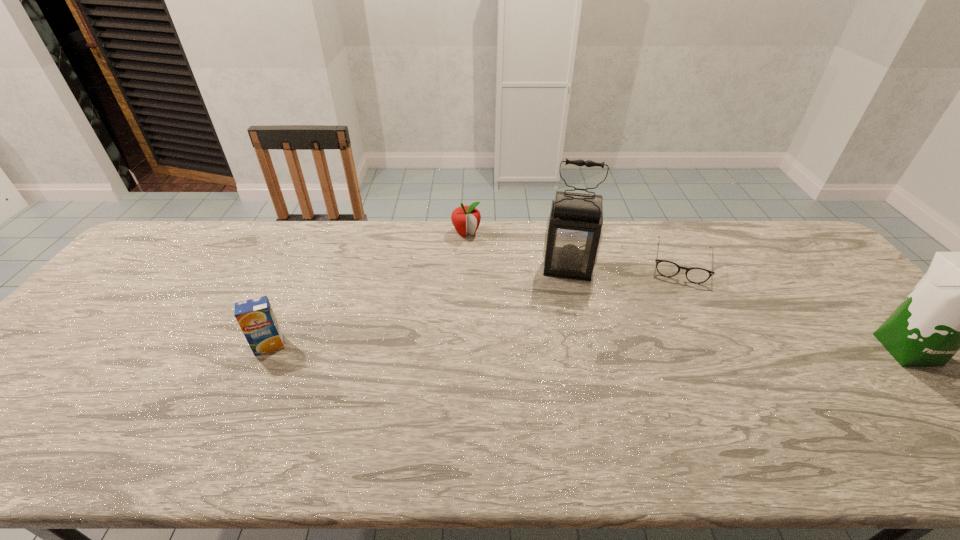
Image resolution: width=960 pixels, height=540 pixels. In order to click on vacant spot on the desktop that is between the orange_juice and the soya milk and is positioned on the side where a bite is taken out of the second shortest object in this screenshot , I will do `click(526, 347)`.

This screenshot has width=960, height=540. Identify the location of vacant space on the desktop that is between the leftmost object and the soya milk and is positioned on the front-facing side of the tallest object. (563, 347).

Find the location of a particular element. The width and height of the screenshot is (960, 540). vacant space on the desktop that is between the third tallest object and the soya milk and is positioned through the lenses of the spectacles is located at coordinates (674, 348).